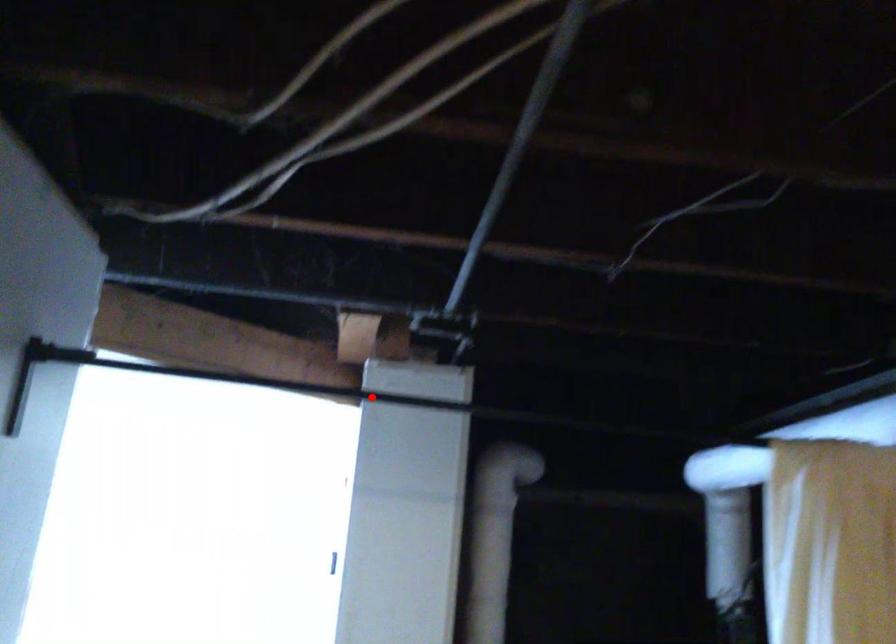
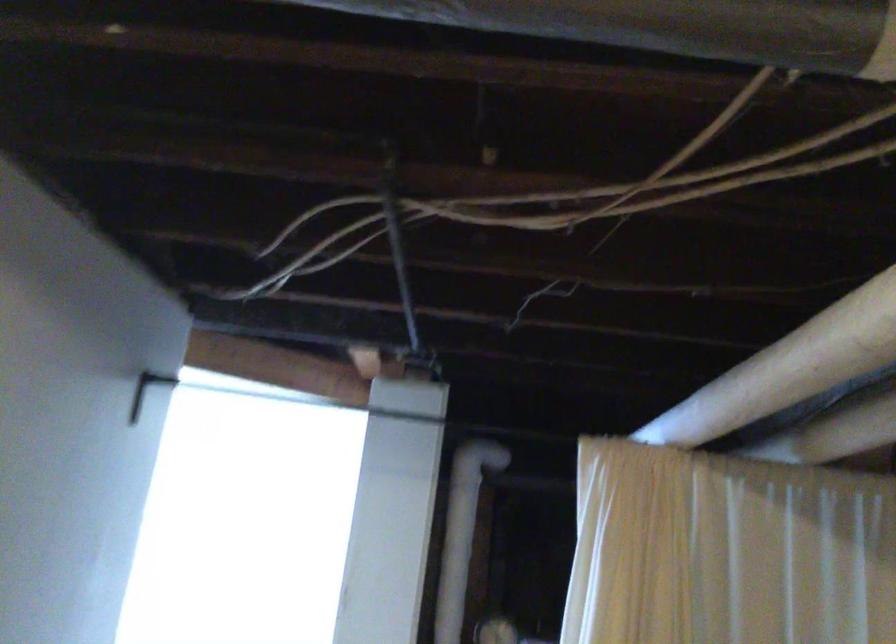
Question: I am providing you with two images of the same scene from different viewpoints. A red point is marked on the first image. At the location where the point appears in image 1, is it still visible in image 2?

Choices:
 (A) Yes
 (B) No

Answer: (B)